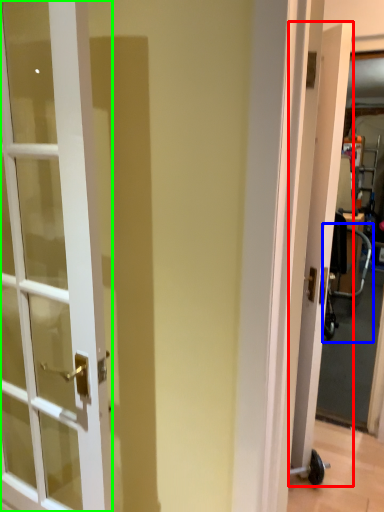
Question: Which is farther away from door (highlighted by a red box)? baby carriage (highlighted by a blue box) or door (highlighted by a green box)?

Choices:
 (A) baby carriage
 (B) door

Answer: (A)